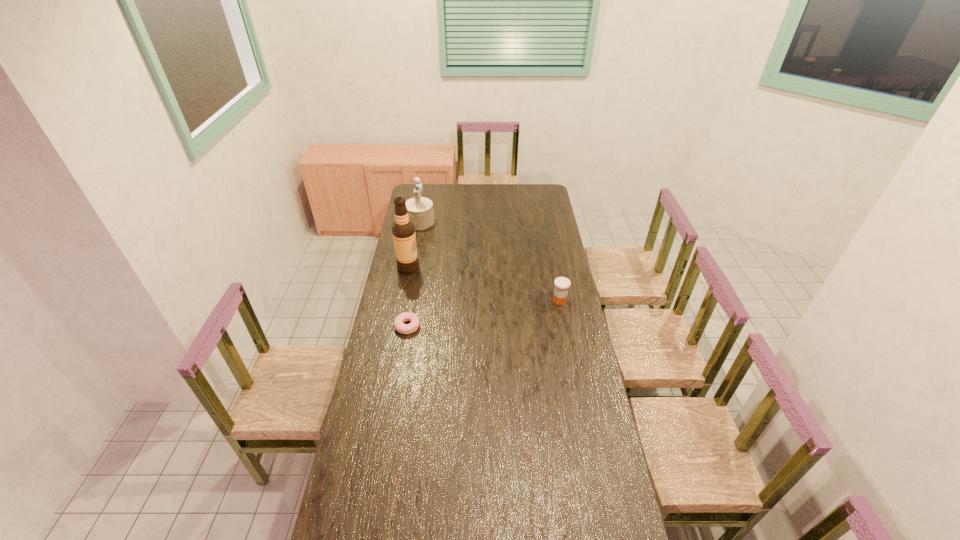
Locate an element on the screen. This screenshot has width=960, height=540. vacant space on the desktop that is between the doughnut and the rightmost object and is positioned at the beak of the figurine is located at coordinates (505, 310).

This screenshot has height=540, width=960. Find the location of `free space on the desktop that is between the shortest object and the third farthest object and is positioned on the label of the tallest object`. free space on the desktop that is between the shortest object and the third farthest object and is positioned on the label of the tallest object is located at coordinates (495, 312).